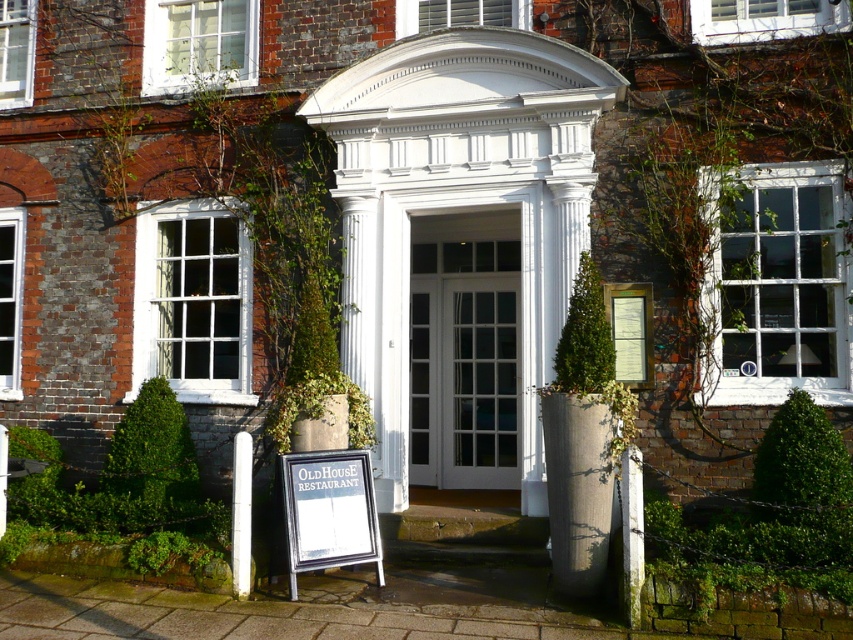
Question: Which object is positioned closest to the white wooden sign at lower left?

Choices:
 (A) white glass door at center
 (B) white stone pillar at lower right

Answer: (B)

Question: Can you confirm if white wooden sign at lower left is wider than white smooth pillar at lower left?

Choices:
 (A) yes
 (B) no

Answer: (A)

Question: Is white glass door at center thinner than white wooden sign at lower left?

Choices:
 (A) no
 (B) yes

Answer: (A)

Question: Which object appears farthest from the camera in this image?

Choices:
 (A) white smooth pillar at lower left
 (B) white wooden sign at lower left
 (C) white stone pillar at lower right
 (D) white glass door at center

Answer: (D)

Question: Does white glass door at center appear over white smooth pillar at lower left?

Choices:
 (A) no
 (B) yes

Answer: (B)

Question: Which object is farther from the camera taking this photo?

Choices:
 (A) white smooth pillar at lower left
 (B) white glass door at center

Answer: (B)